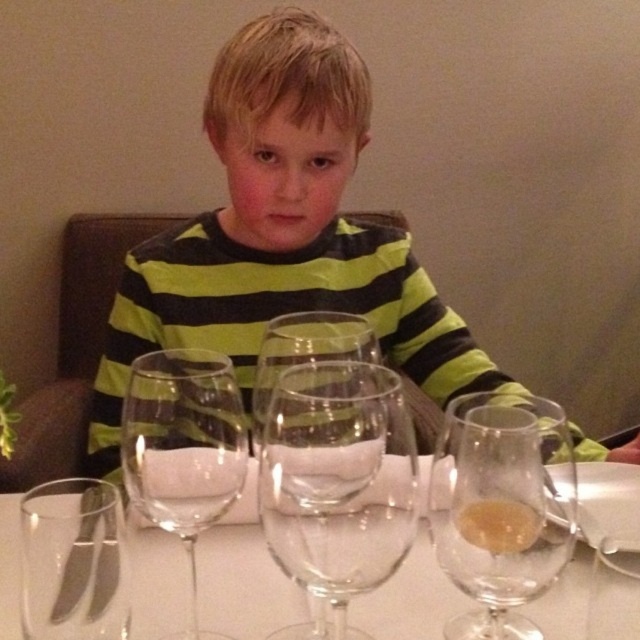
Is green striped shirt at center further to the viewer compared to translucent glass wine glass at center?

Yes, it is.

Describe the element at coordinates (280, 234) in the screenshot. This screenshot has height=640, width=640. I see `green striped shirt at center` at that location.

This screenshot has width=640, height=640. What do you see at coordinates (280, 234) in the screenshot? I see `green striped shirt at center` at bounding box center [280, 234].

Where is `green striped shirt at center`? green striped shirt at center is located at coordinates (280, 234).

Which is in front, point (424, 576) or point (541, 547)?

Point (541, 547) is in front.

Can you confirm if clear glass wine glasses at center is positioned below translucent glass wine glass at center?

Yes, clear glass wine glasses at center is below translucent glass wine glass at center.

Which is behind, point (134, 628) or point (513, 449)?

Point (134, 628)

The width and height of the screenshot is (640, 640). What are the coordinates of `clear glass wine glasses at center` in the screenshot? It's located at click(x=243, y=582).

Describe the element at coordinates (337, 483) in the screenshot. I see `transparent glass wine glass at center` at that location.

How distant is transparent glass wine glass at center from translucent glass wine glass at center?

8.36 centimeters

Which is behind, point (374, 529) or point (545, 465)?

Point (545, 465)

Find the location of a particular element. transparent glass wine glass at center is located at coordinates (337, 483).